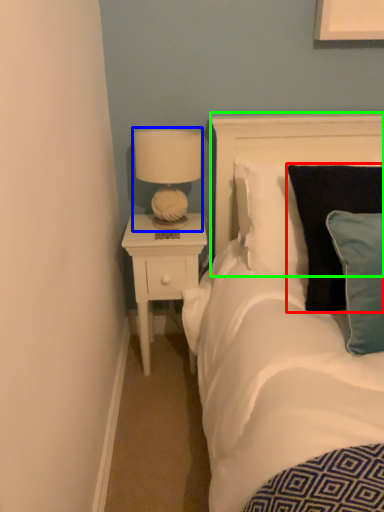
Question: Considering the real-world distances, which object is closest to pillow (highlighted by a red box)? lamp (highlighted by a blue box) or headboard (highlighted by a green box).

Choices:
 (A) lamp
 (B) headboard

Answer: (B)